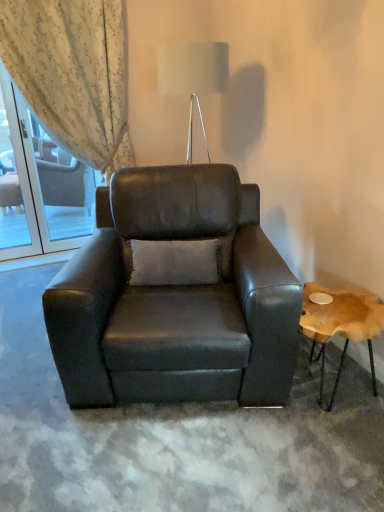
Question: In terms of height, does light beige textured curtain at upper left look taller or shorter compared to metallic silver table lamp at upper center?

Choices:
 (A) tall
 (B) short

Answer: (A)

Question: Is light beige textured curtain at upper left spatially inside metallic silver table lamp at upper center, or outside of it?

Choices:
 (A) inside
 (B) outside

Answer: (B)

Question: Which is farther from the wooden natural stool at right?

Choices:
 (A) light beige textured curtain at upper left
 (B) clear glass screen door at upper left
 (C) metallic silver table lamp at upper center
 (D) matte black armchair at center

Answer: (B)

Question: Which of these objects is positioned closest to the light beige textured curtain at upper left?

Choices:
 (A) wooden natural stool at right
 (B) metallic silver table lamp at upper center
 (C) matte black armchair at center
 (D) clear glass screen door at upper left

Answer: (D)